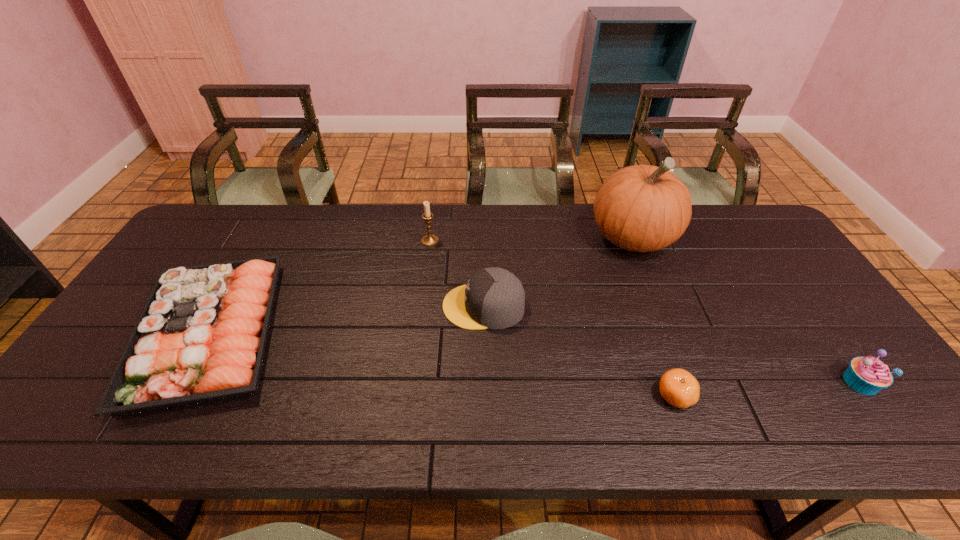
Identify the location of object present at the right edge. (868, 375).

Locate an element on the screen. The width and height of the screenshot is (960, 540). object that is at the near left corner is located at coordinates (201, 337).

In the image, there is a desktop. Identify the location of vacant space at the far edge. Image resolution: width=960 pixels, height=540 pixels. (379, 208).

This screenshot has width=960, height=540. I want to click on vacant space at the near edge of the desktop, so click(x=228, y=411).

Identify the location of vacant space at the right edge. (867, 401).

In the image, there is a desktop. Where is `vacant space at the far left corner`? vacant space at the far left corner is located at coordinates (196, 234).

The height and width of the screenshot is (540, 960). In order to click on vacant space at the far right corner in this screenshot , I will do `click(722, 225)`.

At what (x,y) coordinates should I click in order to perform the action: click on vacant space that is in between the cap and the leftmost object. Please return your answer as a coordinate pair (x, y). This screenshot has width=960, height=540. Looking at the image, I should click on (347, 319).

The height and width of the screenshot is (540, 960). Find the location of `free space between the third object from left to right and the muffin`. free space between the third object from left to right and the muffin is located at coordinates (672, 344).

Find the location of `free spot between the muffin and the cap`. free spot between the muffin and the cap is located at coordinates (672, 344).